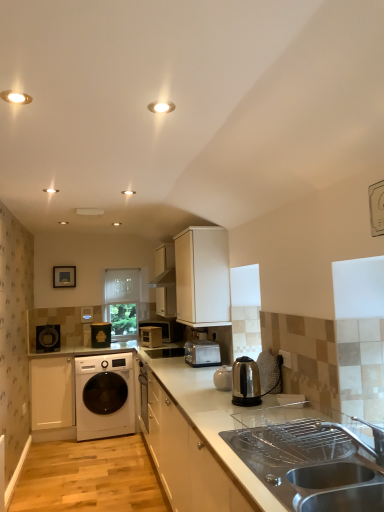
Question: In which direction should I rotate to look at stainless steel kettle at center, marked as the first home appliance in a right-to-left arrangement?

Choices:
 (A) left
 (B) right

Answer: (B)

Question: Is satin silver toaster at center, the 2th home appliance in the front-to-back sequence, beside matte white recessed light at upper center, which is counted as the 1th lighting, starting from the back?

Choices:
 (A) no
 (B) yes

Answer: (A)

Question: Is satin silver toaster at center, the 2th home appliance in the front-to-back sequence, thinner than matte white recessed light at upper center, marked as the first lighting in a right-to-left arrangement?

Choices:
 (A) yes
 (B) no

Answer: (B)

Question: Is satin silver toaster at center, the 2th home appliance in the front-to-back sequence, taller than matte white recessed light at upper center, the 2th lighting positioned from the front?

Choices:
 (A) yes
 (B) no

Answer: (A)

Question: From a real-world perspective, is satin silver toaster at center, marked as the second home appliance in a back-to-front arrangement, positioned under matte white recessed light at upper center, the 2th lighting positioned from the front, based on gravity?

Choices:
 (A) yes
 (B) no

Answer: (A)

Question: From the image's perspective, would you say satin silver toaster at center, the second home appliance from the left, is shown under matte white recessed light at upper center, the 2th lighting positioned from the front?

Choices:
 (A) yes
 (B) no

Answer: (A)

Question: From the image's perspective, is satin silver toaster at center, the 2th home appliance in the front-to-back sequence, above matte white recessed light at upper center, marked as the first lighting in a right-to-left arrangement?

Choices:
 (A) yes
 (B) no

Answer: (B)

Question: From the image's perspective, does matte black speaker at left, which is the first home appliance in back-to-front order, appear lower than metallic silver microwave at center, placed as the second appliance when sorted from left to right?

Choices:
 (A) no
 (B) yes

Answer: (A)

Question: Does matte black speaker at left, which is the first home appliance in back-to-front order, have a greater width compared to metallic silver microwave at center, positioned as the first appliance in right-to-left order?

Choices:
 (A) yes
 (B) no

Answer: (A)

Question: Would you say matte black speaker at left, which is the first home appliance in back-to-front order, is outside metallic silver microwave at center, placed as the second appliance when sorted from left to right?

Choices:
 (A) no
 (B) yes

Answer: (B)

Question: Is matte black speaker at left, positioned as the 3th home appliance in front-to-back order, next to metallic silver microwave at center, positioned as the first appliance in right-to-left order, and touching it?

Choices:
 (A) no
 (B) yes

Answer: (A)

Question: Does matte black speaker at left, the first home appliance from the left, have a lesser width compared to metallic silver microwave at center, positioned as the first appliance in right-to-left order?

Choices:
 (A) yes
 (B) no

Answer: (B)

Question: Is matte black speaker at left, which is the first home appliance in back-to-front order, smaller than metallic silver microwave at center, positioned as the first appliance in right-to-left order?

Choices:
 (A) no
 (B) yes

Answer: (A)

Question: Does white glossy washing machine at lower left come in front of white glossy light fixture at upper left, the second lighting when ordered from right to left?

Choices:
 (A) no
 (B) yes

Answer: (A)